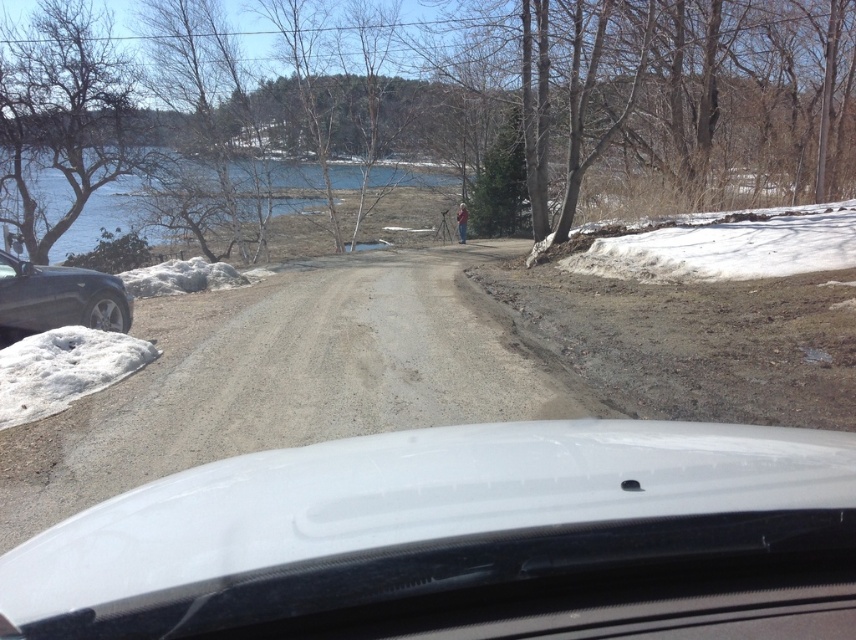
Does white glossy windshield at center appear on the right side of blue water at upper left?

Correct, you'll find white glossy windshield at center to the right of blue water at upper left.

Which is below, white glossy windshield at center or blue water at upper left?

white glossy windshield at center is below.

Who is more forward, [424,564] or [223,241]?

Positioned in front is point [424,564].

Where is `white glossy windshield at center`? The width and height of the screenshot is (856, 640). white glossy windshield at center is located at coordinates (464, 540).

Looking at this image, can you confirm if gray gravel road at center is taller than shiny black sedan at left?

Indeed, gray gravel road at center has a greater height compared to shiny black sedan at left.

In the scene shown: Is gray gravel road at center below shiny black sedan at left?

Yes, gray gravel road at center is below shiny black sedan at left.

Which is behind, point (317, 333) or point (120, 312)?

Point (120, 312)

The height and width of the screenshot is (640, 856). What are the coordinates of `gray gravel road at center` in the screenshot? It's located at (282, 378).

Is white glossy windshield at center in front of shiny black sedan at left?

That is True.

Is white glossy windshield at center smaller than shiny black sedan at left?

Incorrect, white glossy windshield at center is not smaller in size than shiny black sedan at left.

Locate an element on the screen. This screenshot has height=640, width=856. white glossy windshield at center is located at coordinates (464, 540).